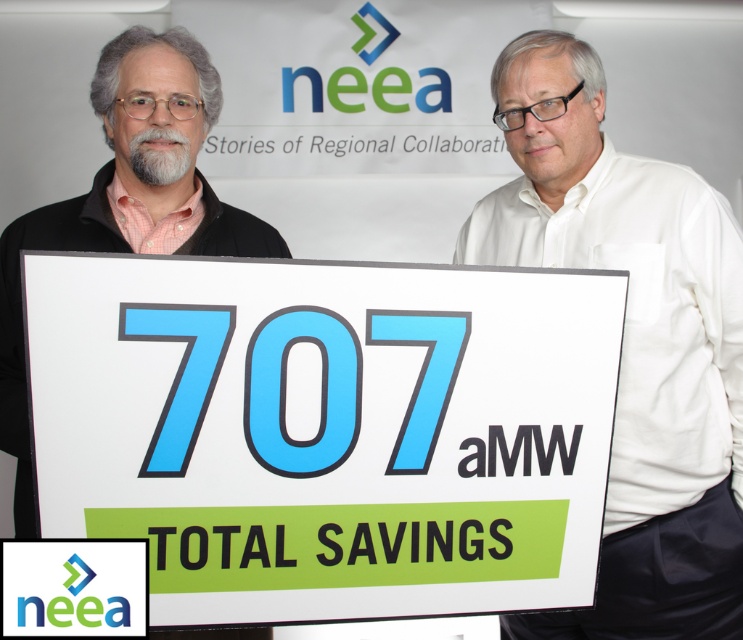
You are a photographer trying to capture a clear photo of the white paper sign at center and the white shirt at center. Which object should you focus on first to ensure it appears sharp in the photo?

You should focus on the white paper sign at center first because it is in front of the white shirt at center, so focusing on the sign will ensure it is sharp while the shirt may still be in acceptable focus depending on the depth of field.

You are a photographer trying to capture a clear photo of the sign. The two people holding the sign are wearing a white shirt at center and a matte black shirt at left. Which person should you focus on to ensure the sign is in focus?

The white shirt at center is much taller as matte black shirt at left, so focusing on the white shirt at center would ensure the sign is in focus since it is positioned higher.

Consider the image. You are designing a poster for a school event and need to ensure that the main message is visible from a distance. Given the scene described, which object from the list would be more effective to reference in terms of size for ensuring visibility, the white paper sign at center or the matte black shirt at left?

The white paper sign at center is larger than the matte black shirt at left, making it more effective for visibility from a distance.